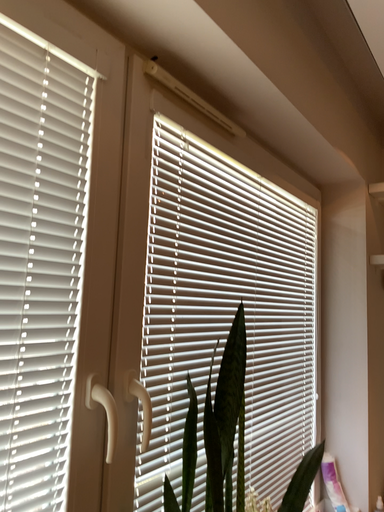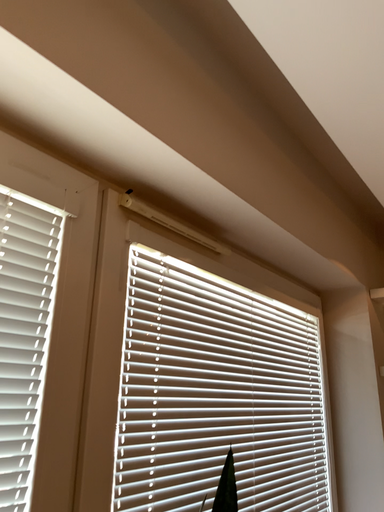
Question: Which way did the camera rotate in the video?

Choices:
 (A) rotated upward
 (B) rotated downward

Answer: (A)